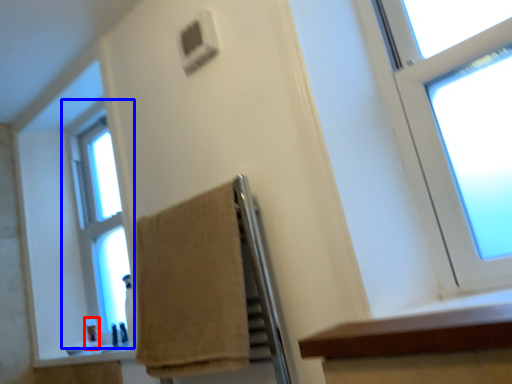
Question: Among these objects, which one is nearest to the camera, toiletry (highlighted by a red box) or window (highlighted by a blue box)?

Choices:
 (A) toiletry
 (B) window

Answer: (A)